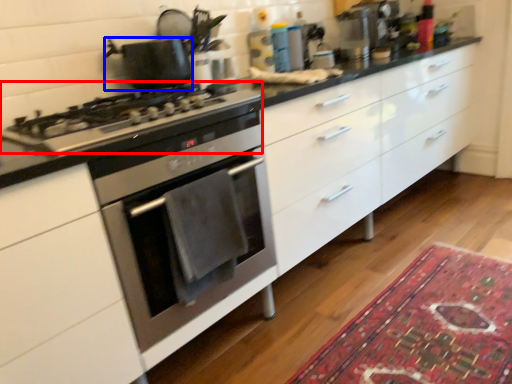
Question: Which object is further to the camera taking this photo, gas stove (highlighted by a red box) or kitchen appliance (highlighted by a blue box)?

Choices:
 (A) gas stove
 (B) kitchen appliance

Answer: (B)